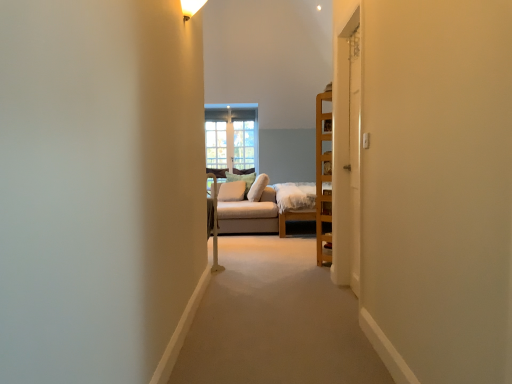
Question: From their relative heights in the image, would you say white painted wood door at right, positioned as the first door in right-to-left order, is taller or shorter than white wooden door at center, which is the 1th door from left to right?

Choices:
 (A) tall
 (B) short

Answer: (B)

Question: From a real-world perspective, is white painted wood door at right, the 2th door positioned from the left, physically located above or below white wooden door at center, the 2th door viewed from the right?

Choices:
 (A) above
 (B) below

Answer: (B)

Question: Which is farther from the soft beige pillow at center, the first pillow when ordered from back to front?

Choices:
 (A) beige fabric couch at center
 (B) white wooden door at center, which is the 1th door from left to right
 (C) clear glass window at center
 (D) soft beige cushion at center, which ranks as the 1th pillow in front-to-back order
 (E) white painted wood door at right, positioned as the first door in right-to-left order

Answer: (E)

Question: Which object is the farthest from the soft beige cushion at center, marked as the second pillow in a back-to-front arrangement?

Choices:
 (A) soft beige pillow at center, which ranks as the 2th pillow in front-to-back order
 (B) white painted wood door at right, positioned as the first door in right-to-left order
 (C) clear glass window at center
 (D) white wooden door at center, which is the 1th door from left to right
 (E) beige fabric couch at center

Answer: (B)